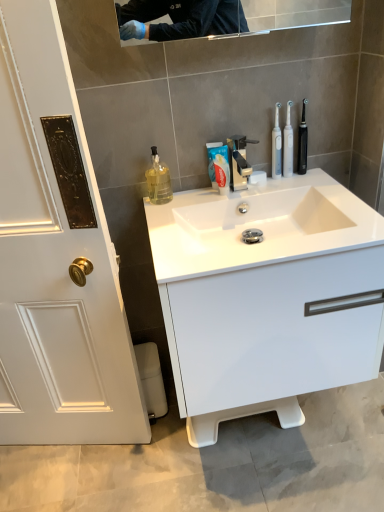
Locate an element on the screen. space that is in front of translucent plastic mouthwash at center, the 1th mouthwash when ordered from right to left is located at coordinates (294, 188).